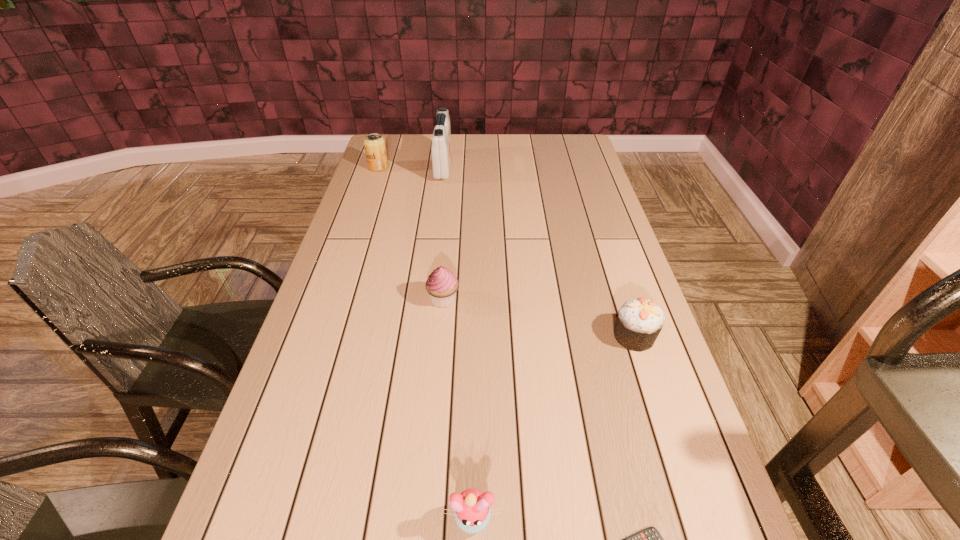
At what (x,y) coordinates should I click in order to perform the action: click on object located at the far edge. Please return your answer as a coordinate pair (x, y). Image resolution: width=960 pixels, height=540 pixels. Looking at the image, I should click on (441, 150).

Find the location of a particular element. The width and height of the screenshot is (960, 540). object at the left edge is located at coordinates (374, 144).

Find the location of `object located at the right edge`. object located at the right edge is located at coordinates (639, 322).

Identify the location of vacant space at the far edge. (529, 154).

In the image, there is a desktop. Where is `free region at the left edge`? The width and height of the screenshot is (960, 540). free region at the left edge is located at coordinates (289, 510).

At what (x,y) coordinates should I click in order to perform the action: click on vacant space at the right edge of the desktop. Please return your answer as a coordinate pair (x, y). This screenshot has width=960, height=540. Looking at the image, I should click on (583, 260).

In the image, there is a desktop. Where is `vacant space at the far left corner`? The height and width of the screenshot is (540, 960). vacant space at the far left corner is located at coordinates (400, 136).

In the image, there is a desktop. At what (x,y) coordinates should I click in order to perform the action: click on vacant area at the far right corner. Please return your answer as a coordinate pair (x, y). Looking at the image, I should click on (571, 152).

At what (x,y) coordinates should I click in order to perform the action: click on vacant area that lies between the nearest cupcake and the first-aid kit. Please return your answer as a coordinate pair (x, y). The image size is (960, 540). Looking at the image, I should click on (458, 342).

Where is `vacant area between the farthest cupcake and the tallest object`? The image size is (960, 540). vacant area between the farthest cupcake and the tallest object is located at coordinates click(444, 233).